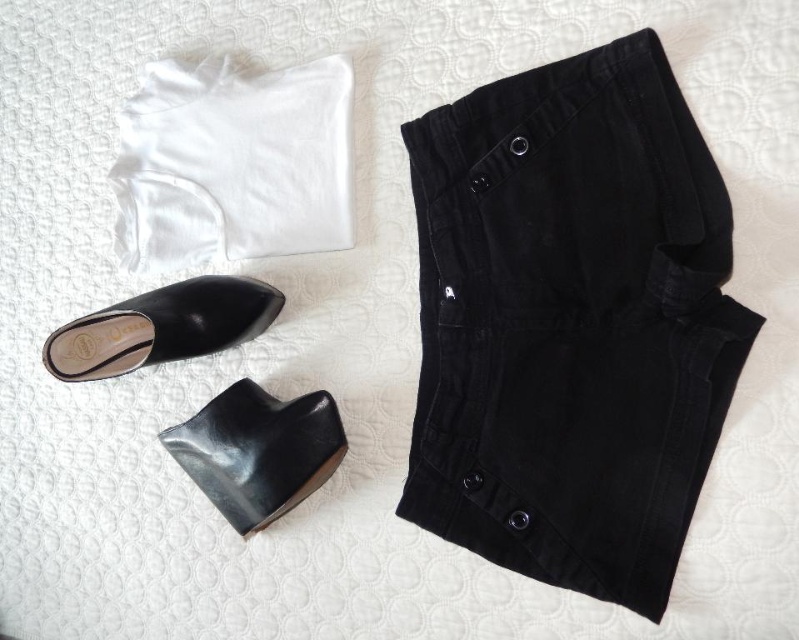
Is black corduroy shorts at center behind black leather dress shoe at lower left?

That is False.

Is black corduroy shorts at center positioned in front of black leather dress shoe at lower left?

Yes, black corduroy shorts at center is closer to the viewer.

Does point (595, 54) come farther from viewer compared to point (265, 429)?

No, it is not.

Identify the location of black corduroy shorts at center. The width and height of the screenshot is (799, 640). (571, 323).

Who is more distant from viewer, (122, 260) or (117, 355)?

Point (122, 260)

Which is in front, point (348, 104) or point (205, 282)?

Positioned in front is point (348, 104).

The height and width of the screenshot is (640, 799). I want to click on white smooth t-shirt at upper left, so click(x=233, y=163).

What do you see at coordinates (571, 323) in the screenshot? The width and height of the screenshot is (799, 640). I see `black corduroy shorts at center` at bounding box center [571, 323].

Based on the photo, does black corduroy shorts at center appear under white smooth t-shirt at upper left?

Indeed, black corduroy shorts at center is positioned under white smooth t-shirt at upper left.

I want to click on black corduroy shorts at center, so click(x=571, y=323).